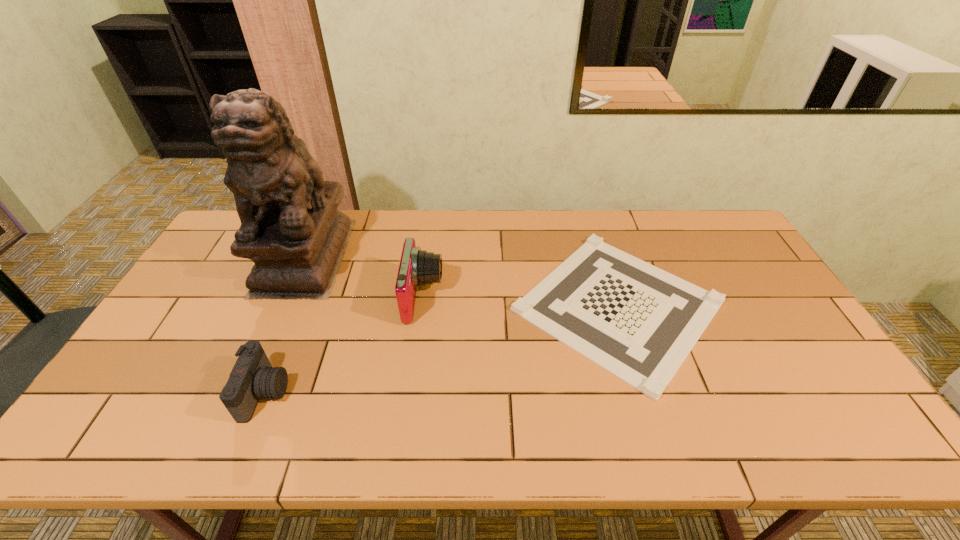
Where is `vacant space located on the front of the checkerboard`? This screenshot has height=540, width=960. vacant space located on the front of the checkerboard is located at coordinates (656, 425).

You are a GUI agent. You are given a task and a screenshot of the screen. Output one action in this format:
    pyautogui.click(x=<x>, y=<y>)
    Task: Click on the sculpture at the far edge
    
    Given the screenshot: What is the action you would take?
    pyautogui.click(x=291, y=229)

This screenshot has width=960, height=540. I want to click on checkerboard present at the far edge, so click(x=635, y=320).

Find the location of a particular element. The width and height of the screenshot is (960, 540). object present at the near edge is located at coordinates (252, 378).

The width and height of the screenshot is (960, 540). In the image, there is a desktop. Identify the location of free region at the far edge. (381, 243).

Find the location of a particular element. This screenshot has height=540, width=960. vacant space at the near edge is located at coordinates coord(516,428).

In the image, there is a desktop. Identify the location of vacant space at the left edge. This screenshot has height=540, width=960. (155, 387).

You are a GUI agent. You are given a task and a screenshot of the screen. Output one action in this format:
    pyautogui.click(x=<x>, y=<y>)
    Task: Click on the blank space at the right edge
    This screenshot has width=960, height=540.
    Given the screenshot: What is the action you would take?
    pyautogui.click(x=821, y=375)

Where is `vacant space at the near right corner of the desktop`? vacant space at the near right corner of the desktop is located at coordinates (857, 435).

In order to click on vacant space that is in between the shorter camera and the tallest object in this screenshot , I will do `click(285, 325)`.